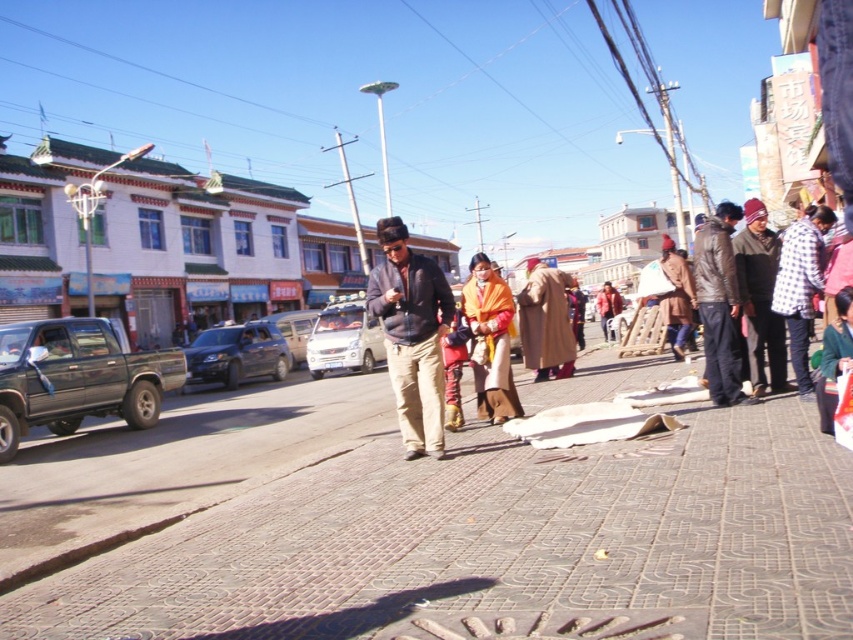
Question: Can you confirm if orange woolen scarf at center is smaller than metallic silver car at center?

Choices:
 (A) no
 (B) yes

Answer: (B)

Question: Is dark gray jacket at center to the right of orange woolen scarf at center from the viewer's perspective?

Choices:
 (A) yes
 (B) no

Answer: (B)

Question: Which of the following is the closest to the observer?

Choices:
 (A) dark green matte truck at left
 (B) white matte car at center
 (C) dark gray jacket at center

Answer: (C)

Question: Based on their relative distances, which object is nearer to the orange woolen scarf at center?

Choices:
 (A) metallic silver car at center
 (B) shiny black suv at center-left

Answer: (B)

Question: Which point is closer to the camera taking this photo?

Choices:
 (A) (126, 369)
 (B) (337, 360)
 (C) (489, 358)
 (D) (718, 208)

Answer: (D)

Question: Is the position of shiny black suv at center-left less distant than that of metallic silver car at center?

Choices:
 (A) yes
 (B) no

Answer: (A)